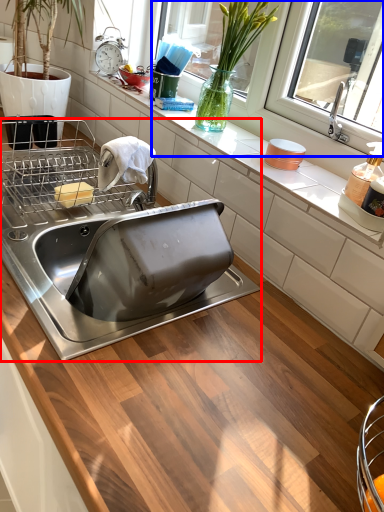
Question: Among these objects, which one is nearest to the camera, sink (highlighted by a red box) or window screen (highlighted by a blue box)?

Choices:
 (A) sink
 (B) window screen

Answer: (A)